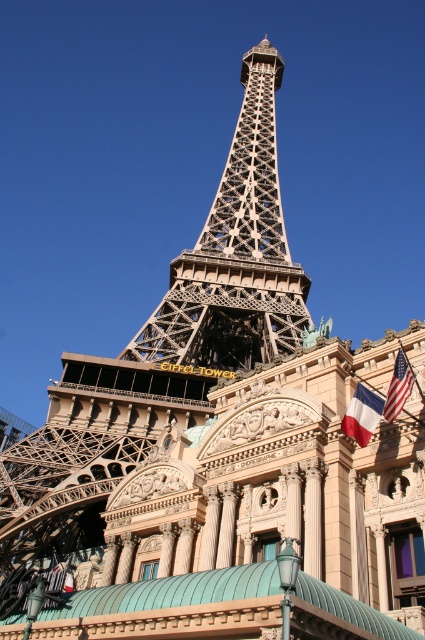
You are standing in front of the building with the green metal dome roof and want to walk towards the Eiffel Tower replica. Which of the two points, point (x=289, y=300) or point (x=368, y=432), should you avoid stepping on to stay on the path towards the Eiffel Tower replica?

You should avoid stepping on point (x=368, y=432) because point (x=289, y=300) is behind it, so stepping on the closer point (x=368, y=432) would block your path towards the Eiffel Tower replica.

You are a photographer planning to capture a symmetrical shot of the metallic lattice structure at center and the american flag at upper right. Considering their positions, which object should you place closer to the center of your camera frame to maintain symmetry?

To maintain symmetry, you should position the metallic lattice structure at center closer to the center of the camera frame since it is wider than the american flag at upper right.

You are a visitor at this location and want to take a photo that includes both the red fabric flag at right and the american flag at upper right. Which flag should you position closer to the center of your camera frame to ensure both flags are fully visible in the photo?

The red fabric flag at right is wider than the american flag at upper right, so positioning the red fabric flag at right closer to the center of your camera frame will help ensure both flags are fully visible in the photo.